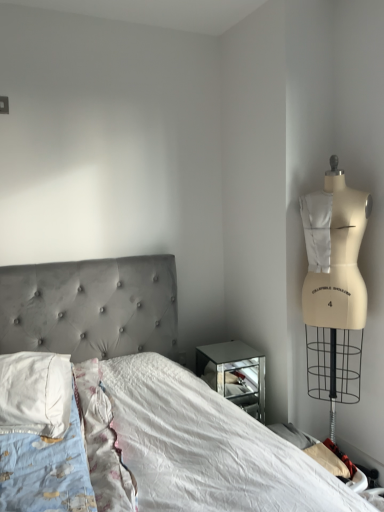
Question: Looking at their shapes, would you say velvet grey bed at center is wider or thinner than white soft pillow at left?

Choices:
 (A) wide
 (B) thin

Answer: (A)

Question: Is velvet grey bed at center to the left or to the right of white soft pillow at left in the image?

Choices:
 (A) left
 (B) right

Answer: (B)

Question: From a real-world perspective, relative to white soft pillow at left, is velvet grey bed at center vertically above or below?

Choices:
 (A) below
 (B) above

Answer: (A)

Question: Is white soft pillow at left spatially inside velvet grey bed at center, or outside of it?

Choices:
 (A) outside
 (B) inside

Answer: (B)

Question: Considering the positions of white soft pillow at left and velvet grey bed at center in the image, is white soft pillow at left wider or thinner than velvet grey bed at center?

Choices:
 (A) wide
 (B) thin

Answer: (B)

Question: From a real-world perspective, relative to velvet grey bed at center, is white soft pillow at left vertically above or below?

Choices:
 (A) below
 (B) above

Answer: (B)

Question: From their relative heights in the image, would you say white soft pillow at left is taller or shorter than velvet grey bed at center?

Choices:
 (A) tall
 (B) short

Answer: (B)